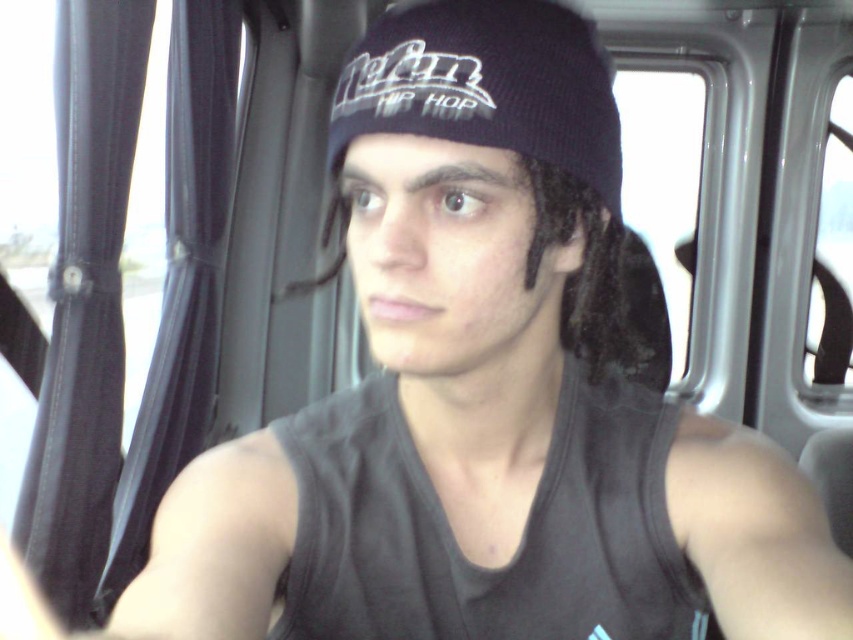
Between smooth skin muscle at lower right and muscle at upper right, which one is positioned higher?

smooth skin muscle at lower right

Between point (698, 508) and point (201, 502), which one is positioned in front?

Point (201, 502) is more forward.

Is point (757, 435) closer to camera compared to point (254, 464)?

No, it is not.

Where is `smooth skin muscle at lower right`? smooth skin muscle at lower right is located at coordinates (755, 534).